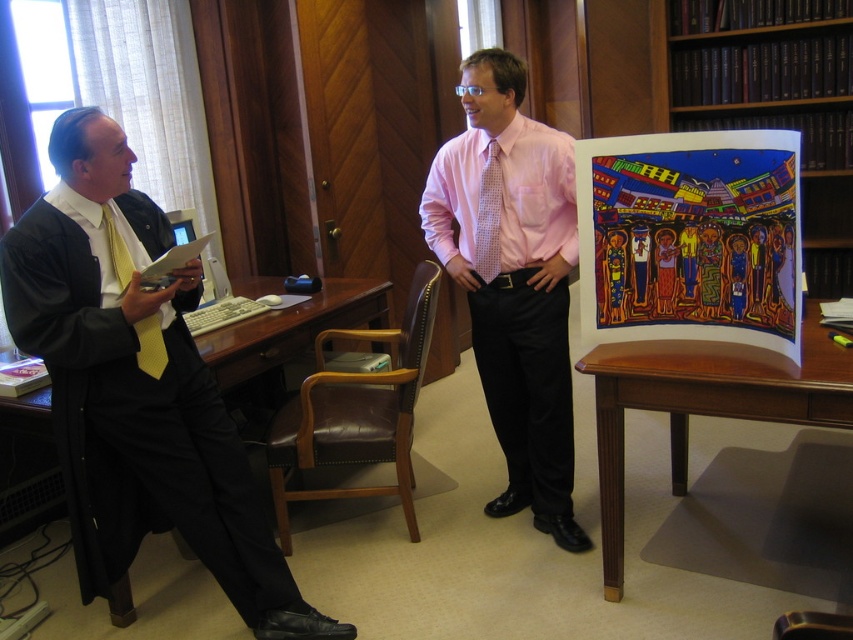
Question: Is pink textured dress shirt at center bigger than yellowtexturetie at left?

Choices:
 (A) yes
 (B) no

Answer: (A)

Question: Which point is closer to the camera?

Choices:
 (A) (461, 166)
 (B) (677, 490)
 (C) (492, 220)
 (D) (131, 273)

Answer: (D)

Question: Which of the following is the farthest from the observer?

Choices:
 (A) pink textured dress shirt at center
 (B) pink dotted tie at center
 (C) pink satin shirt at center
 (D) yellowtexturetie at left

Answer: (B)

Question: In this image, where is wooden bookshelf at upper right located relative to brown wood table at lower right?

Choices:
 (A) below
 (B) above

Answer: (B)

Question: Which point appears closest to the camera in this image?

Choices:
 (A) (474, 253)
 (B) (541, 204)

Answer: (B)

Question: Does matte black suit at left have a larger size compared to brown wood table at lower right?

Choices:
 (A) yes
 (B) no

Answer: (A)